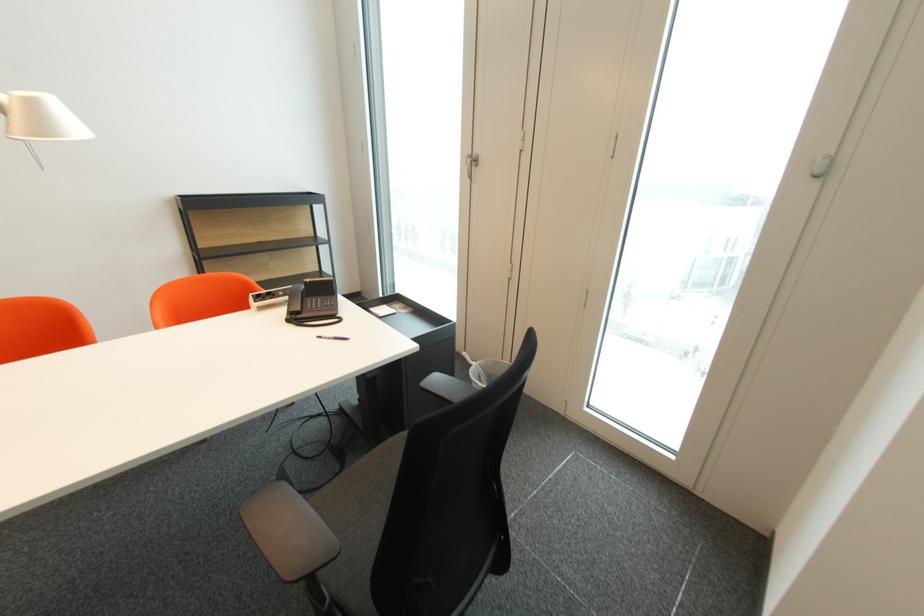
The location [484,370] corresponds to which object?

It corresponds to the wire mesh wastebasket in the image.